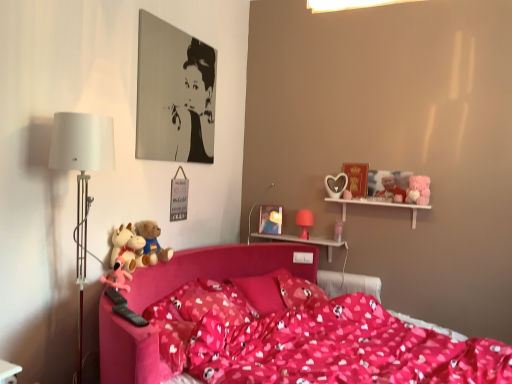
Question: Are white wooden shelf at upper right and white glossy table at lower left, which appears as the second table when viewed from the right, located far from each other?

Choices:
 (A) yes
 (B) no

Answer: (A)

Question: Can you confirm if white wooden shelf at upper right is smaller than white glossy table at lower left, the second table viewed from the back?

Choices:
 (A) yes
 (B) no

Answer: (B)

Question: Can you confirm if white wooden shelf at upper right is wider than white glossy table at lower left, the second table positioned from the top?

Choices:
 (A) yes
 (B) no

Answer: (A)

Question: Is white wooden shelf at upper right bigger than white glossy table at lower left, the first table in the front-to-back sequence?

Choices:
 (A) yes
 (B) no

Answer: (A)

Question: Is white wooden shelf at upper right looking in the opposite direction of white glossy table at lower left, the second table positioned from the top?

Choices:
 (A) no
 (B) yes

Answer: (A)

Question: Do you think fluffy plush toys at left, the 2th toy positioned from the back, is within matte plastic picture frame at upper center, or outside of it?

Choices:
 (A) inside
 (B) outside

Answer: (B)

Question: Is fluffy plush toys at left, the third toy in the front-to-back sequence, in front of or behind matte plastic picture frame at upper center in the image?

Choices:
 (A) front
 (B) behind

Answer: (A)

Question: In terms of height, does fluffy plush toys at left, the 2th toy positioned from the back, look taller or shorter compared to matte plastic picture frame at upper center?

Choices:
 (A) short
 (B) tall

Answer: (A)

Question: Based on their sizes in the image, would you say fluffy plush toys at left, which ranks as the second toy in right-to-left order, is bigger or smaller than matte plastic picture frame at upper center?

Choices:
 (A) big
 (B) small

Answer: (A)

Question: From the image's perspective, relative to pink matte table lamp at upper right, positioned as the second table lamp in left-to-right order, is fluffy pink teddy bear at upper right above or below?

Choices:
 (A) above
 (B) below

Answer: (A)

Question: In the image, is fluffy pink teddy bear at upper right positioned in front of or behind pink matte table lamp at upper right, which is counted as the 1th table lamp, starting from the right?

Choices:
 (A) front
 (B) behind

Answer: (A)

Question: Is point (415, 188) closer or farther from the camera than point (309, 225)?

Choices:
 (A) farther
 (B) closer

Answer: (B)

Question: Based on their sizes in the image, would you say fluffy pink teddy bear at upper right is bigger or smaller than pink matte table lamp at upper right, which is the second table lamp from front to back?

Choices:
 (A) big
 (B) small

Answer: (A)

Question: Would you say smooth plastic santa claus at upper right, placed as the 4th toy when sorted from left to right, is inside or outside fluffy pink teddy bear at upper right?

Choices:
 (A) outside
 (B) inside

Answer: (A)

Question: From the image's perspective, relative to fluffy pink teddy bear at upper right, is smooth plastic santa claus at upper right, placed as the 4th toy when sorted from left to right, above or below?

Choices:
 (A) below
 (B) above

Answer: (B)